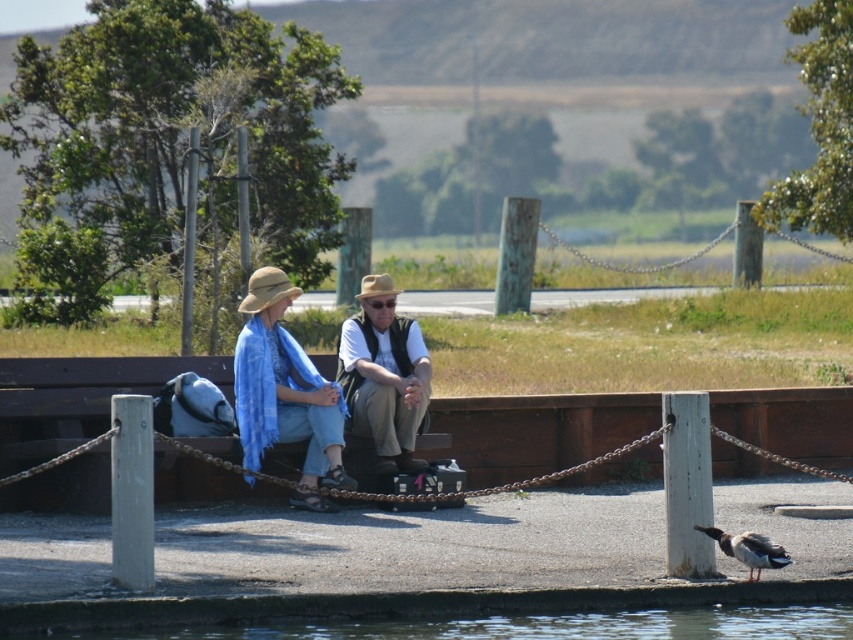
You are standing at the point labeled as point (248, 285) and want to walk to the point labeled point (169, 486). According to the scene, which direction should you face to move towards your destination?

You should face backward because point (169, 486) is behind point (248, 285).

You are a photographer trying to capture a closeup of the matte brown hat at center. The camera you are using has a focal length of 100mm and you are currently standing at point 0.586, 0.451. What should you do to ensure the hat is in focus?

Since the matte brown hat at center is already at point [384,374] where you are standing, you should adjust the camera focus to that exact coordinate to ensure the hat is in focus.

You are a photographer trying to capture a photo of the wooden park bench at center and the matte white shirt at center. Which object should you focus on first if you want to include both in your frame without moving the camera?

Since the wooden park bench at center is smaller than the matte white shirt at center, you should focus on the matte white shirt at center first to ensure it fits properly in the frame.